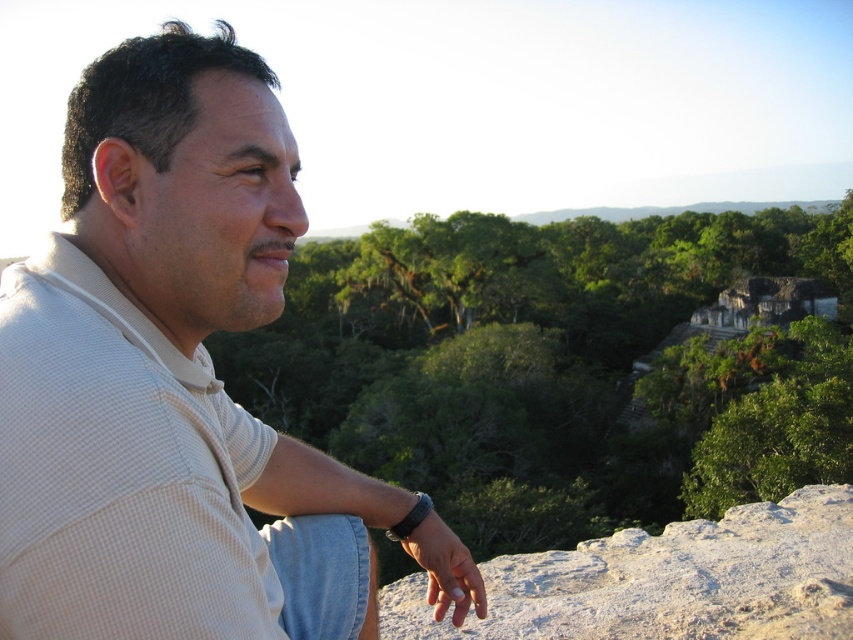
You are a hiker who just arrived at the ruins and want to take a photo of the black leather watch at lower center and the green leafy trees at center. Which object should you position closer to the left side of the photo frame?

The black leather watch at lower center should be positioned closer to the left side of the photo frame because the green leafy trees at center are to the right of it.

You are standing at the same position as the man in the image. Which of the two points, point (x=709, y=273) or point (x=432, y=605), is closer to you?

Point (x=709, y=273) is closer to you because it is further to the viewer than point (x=432, y=605).

You are a hiker who wants to take a photo of the white rough stone at center and the green leafy trees at center. Which object should you focus on first if you want to capture both in the same frame?

The green leafy trees at center is positioned on the left side of white rough stone at center, so you should focus on the green leafy trees at center first to ensure both are in the frame.